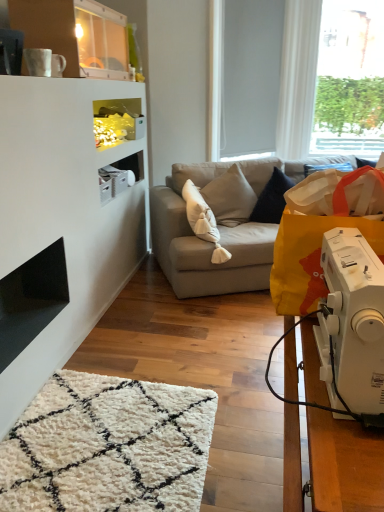
Where is `free location above white plastic sewing machine at lower right (from a real-world perspective)`? free location above white plastic sewing machine at lower right (from a real-world perspective) is located at coordinates (354, 249).